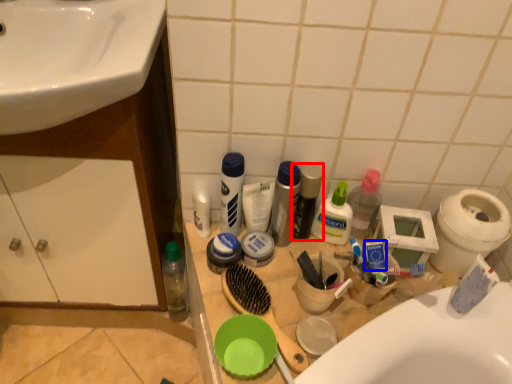
Question: Among these objects, which one is nearest to the camera, toiletry (highlighted by a red box) or toothpaste (highlighted by a blue box)?

Choices:
 (A) toiletry
 (B) toothpaste

Answer: (B)